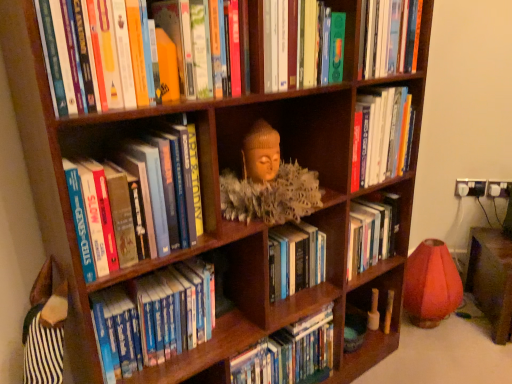
Question: Considering the positions of hardcover book at center, which ranks as the fourth book in top-to-bottom order, and blue hardcover books at center, the fifth book positioned from the top, in the image, is hardcover book at center, which ranks as the fourth book in top-to-bottom order, taller or shorter than blue hardcover books at center, the fifth book positioned from the top,?

Choices:
 (A) tall
 (B) short

Answer: (B)

Question: Does point (385, 228) appear closer or farther from the camera than point (187, 263)?

Choices:
 (A) farther
 (B) closer

Answer: (A)

Question: Considering the real-world distances, which object is closest to the hardcover books at center, marked as the first book in a bottom-to-top arrangement?

Choices:
 (A) hardcover book at center, which ranks as the fourth book in top-to-bottom order
 (B) matte wooden sculpture at center
 (C) blue hardcover books at center, the fifth book positioned from the top
 (D) hardcover books at center, the second book in the top-to-bottom sequence
 (E) green matte book at upper center, placed as the 6th book when sorted from bottom to top

Answer: (C)

Question: Which object is the farthest from the matte wooden sculpture at center?

Choices:
 (A) hardcover books at left, which ranks as the fourth book in bottom-to-top order
 (B) hardcover books at center, marked as the first book in a bottom-to-top arrangement
 (C) hardcover book at center, which appears as the 3th book when ordered from the bottom
 (D) blue hardcover books at center, the fifth book positioned from the top
 (E) hardcover books at center, the second book in the top-to-bottom sequence

Answer: (B)